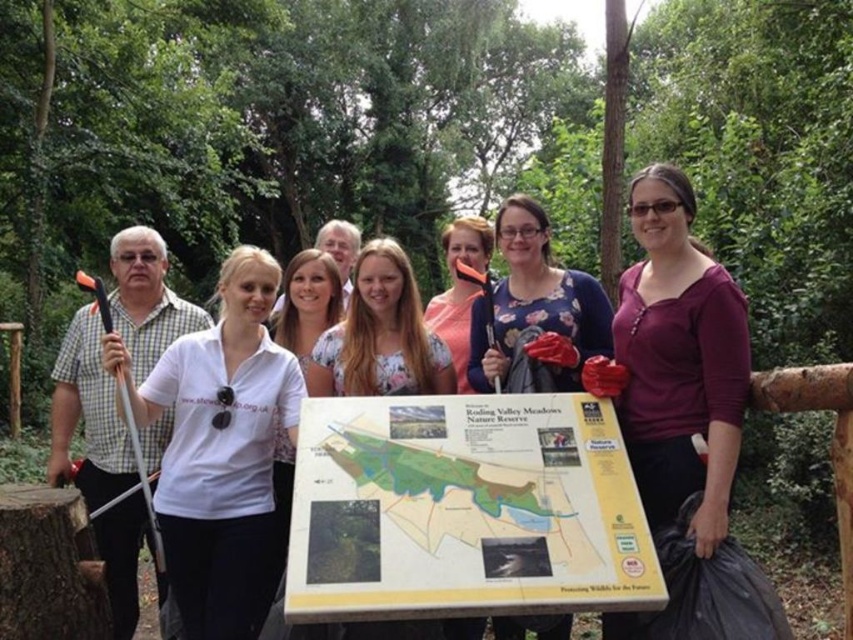
You are a photographer standing at the edge of the group. You want to take a photo that includes both the yellow matte board at center and the matte blue shirt at center. Given that your camera has a maximum focus range of 60 centimeters, will you be able to capture both objects in focus without moving closer?

The yellow matte board at center and the matte blue shirt at center are 67.83 centimeters apart from each other. Since the distance between them exceeds the camera maximum focus range of 60 centimeters, you will not be able to capture both objects in focus without moving closer.

Consider the image. You are organizing a community cleanup event and need to identify which clothing item is more suitable for the task based on their sizes. The floral fabric shirt at center and the floral fabric blouse at center are both available. Which one is smaller and thus less likely to hinder movement?

The floral fabric shirt at center is smaller in size compared to the floral fabric blouse at center, making it less likely to hinder movement.